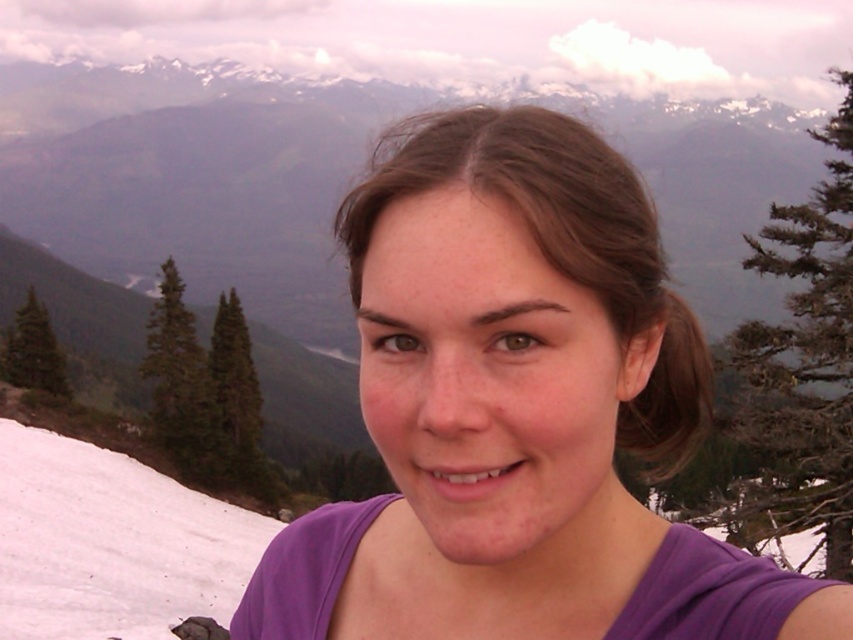
Can you confirm if green matte pine at center is taller than green matte pine at left?

Yes, green matte pine at center is taller than green matte pine at left.

Which is in front, point (221, 301) or point (62, 355)?

Point (221, 301) is more forward.

Is point (242, 438) positioned behind point (30, 296)?

Yes, point (242, 438) is behind point (30, 296).

Where is `green matte pine at center`? This screenshot has height=640, width=853. green matte pine at center is located at coordinates (236, 401).

Does point (73, 630) come farther from viewer compared to point (16, 316)?

No, (73, 630) is in front of (16, 316).

Does point (144, 522) come in front of point (22, 384)?

Yes, it is in front of point (22, 384).

Does point (41, 566) come behind point (32, 326)?

That is False.

Locate an element on the screen. white snow at lower left is located at coordinates (111, 544).

In the scene shown: Who is shorter, green textured pine tree at left or green matte pine at center?

With less height is green textured pine tree at left.

This screenshot has width=853, height=640. In order to click on green textured pine tree at left in this screenshot , I will do point(177,372).

Is point (202, 440) closer to camera compared to point (239, 483)?

Yes, point (202, 440) is closer to viewer.

Locate an element on the screen. green textured pine tree at left is located at coordinates (177, 372).